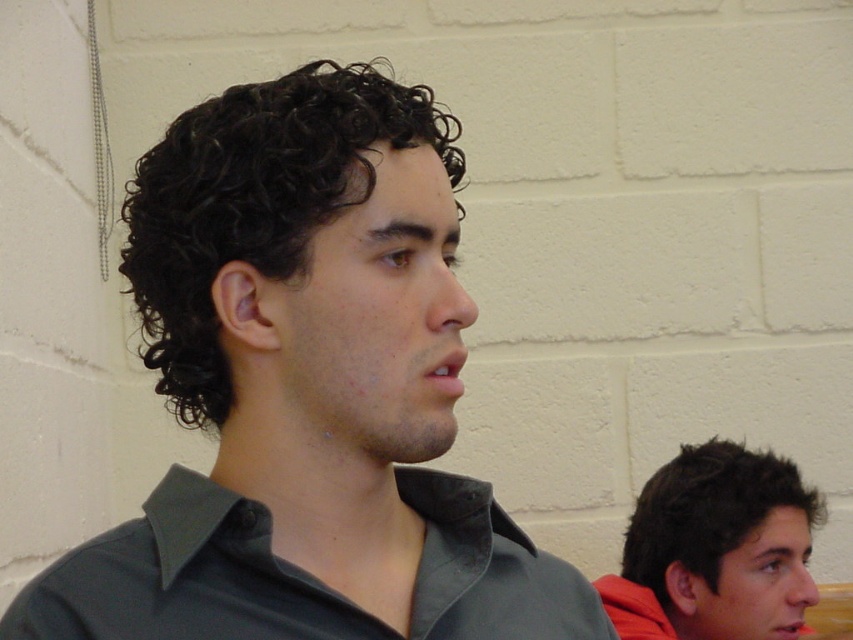
Question: Can you confirm if dark green shirt at center is positioned to the left of dark curly hair at center?

Choices:
 (A) no
 (B) yes

Answer: (A)

Question: Can you confirm if dark curly hair at center is wider than dark brown curly hair at lower right?

Choices:
 (A) yes
 (B) no

Answer: (B)

Question: Which point is closer to the camera taking this photo?

Choices:
 (A) (218, 538)
 (B) (387, 97)
 (C) (717, 518)

Answer: (A)

Question: Which of the following is the farthest from the observer?

Choices:
 (A) (351, 298)
 (B) (773, 492)
 (C) (215, 353)
 (D) (190, 525)

Answer: (B)

Question: Which of the following is the closest to the observer?

Choices:
 (A) (662, 518)
 (B) (595, 604)
 (C) (228, 102)
 (D) (329, 252)

Answer: (D)

Question: From the image, what is the correct spatial relationship of dark green shirt at center in relation to dark gray cotton shirt at center?

Choices:
 (A) above
 (B) below

Answer: (A)